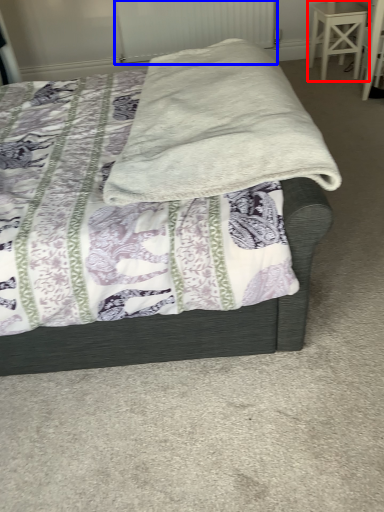
Question: Which point is closer to the camera, stool (highlighted by a red box) or radiator (highlighted by a blue box)?

Choices:
 (A) stool
 (B) radiator

Answer: (A)